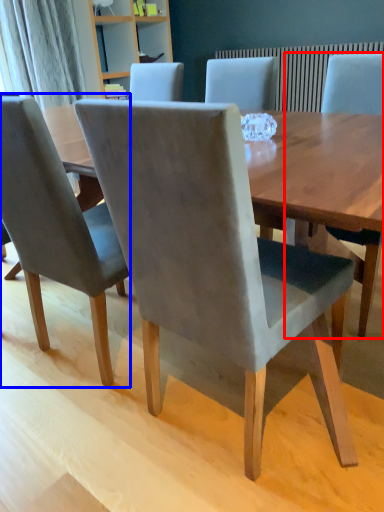
Question: Which object appears closest to the camera in this image, chair (highlighted by a red box) or chair (highlighted by a blue box)?

Choices:
 (A) chair
 (B) chair

Answer: (B)